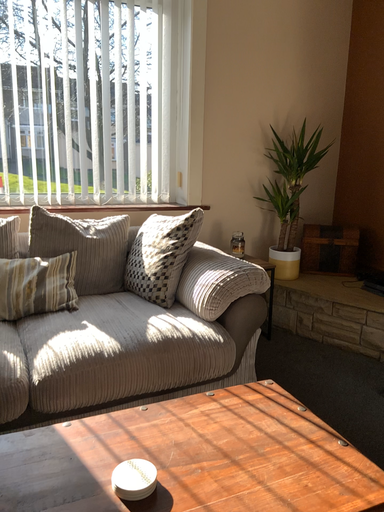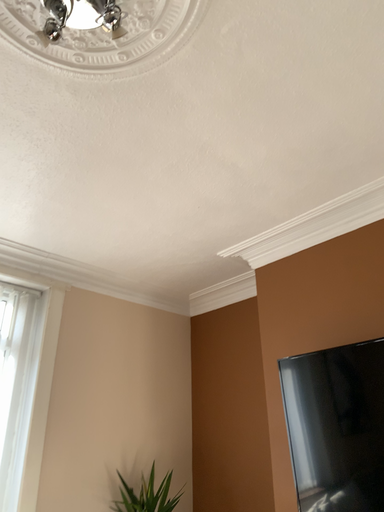
Question: How did the camera likely rotate when shooting the video?

Choices:
 (A) rotated left
 (B) rotated right

Answer: (B)